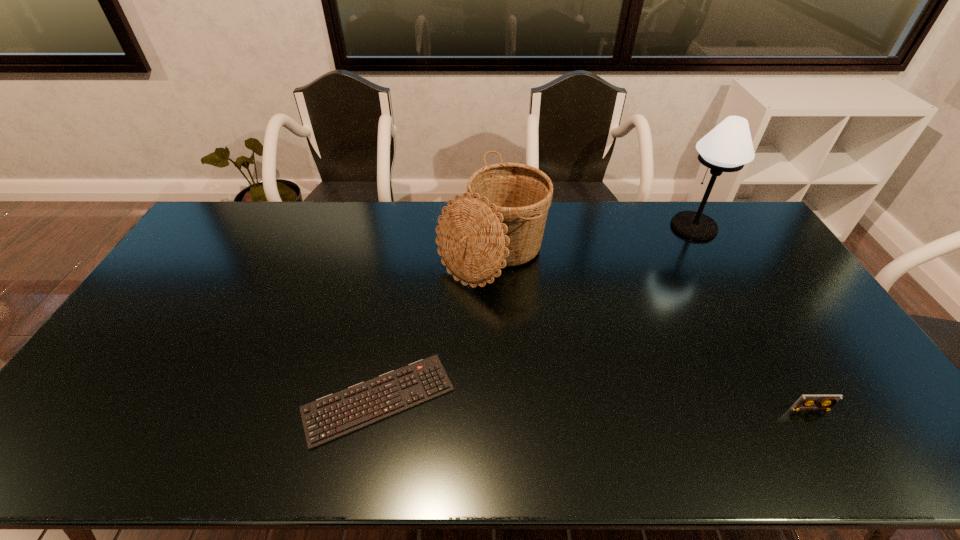
Find the location of a particular element. The height and width of the screenshot is (540, 960). vacant space that satisfies the following two spatial constraints: 1. on the back side of the tallest object; 2. on the left side of the basket is located at coordinates (492, 227).